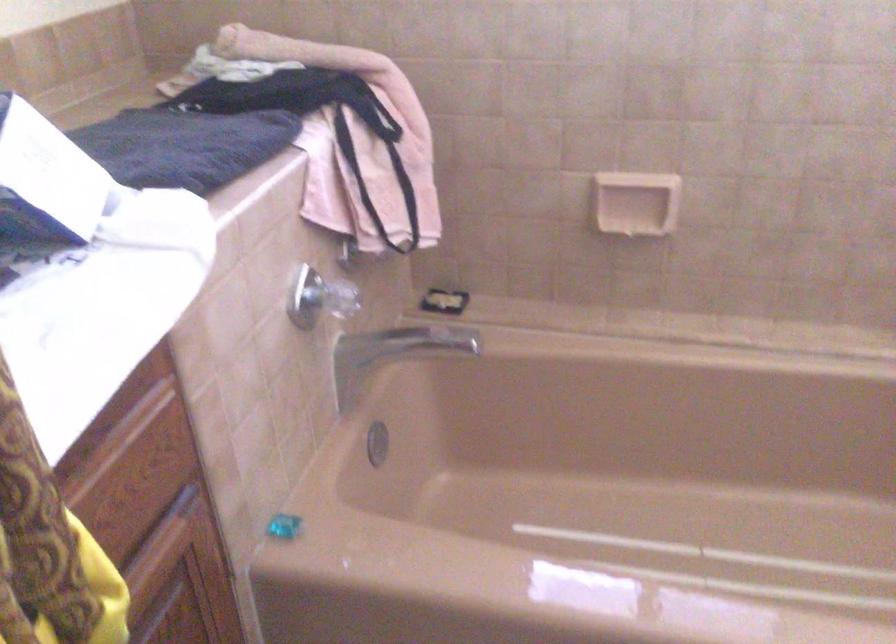
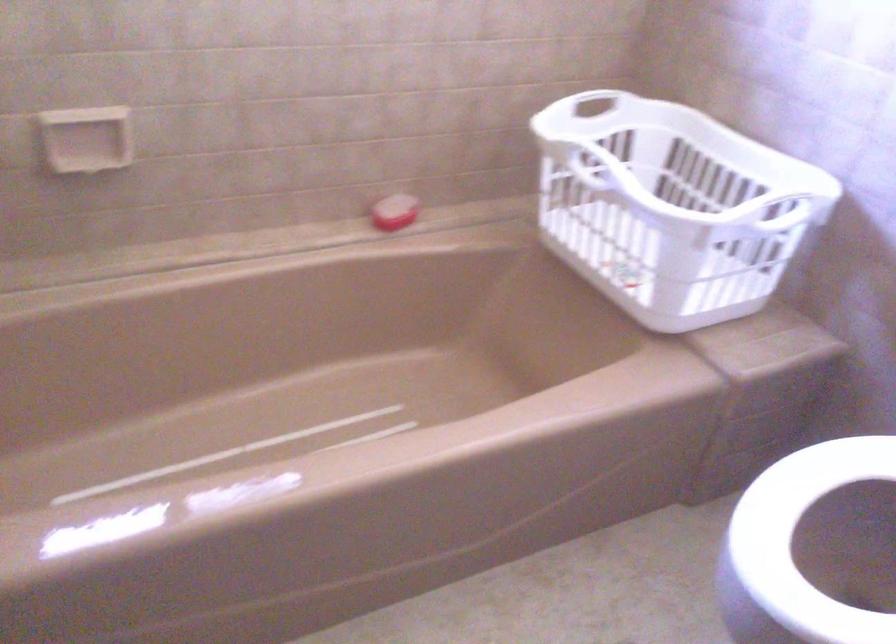
Question: The camera is either moving clockwise (left) or counter-clockwise (right) around the object. The first image is from the beginning of the video and the second image is from the end. Is the camera moving left or right when shooting the video?

Choices:
 (A) Left
 (B) Right

Answer: (A)